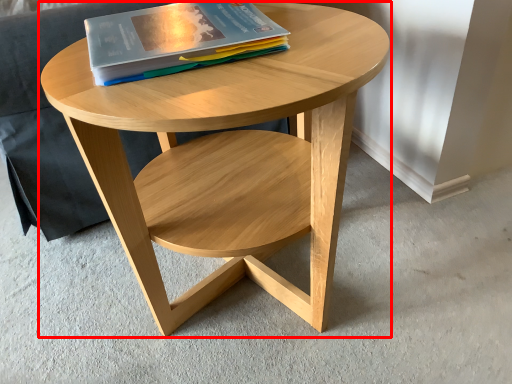
Question: In this image, where is coffee table (annotated by the red box) located relative to book?

Choices:
 (A) right
 (B) left

Answer: (A)